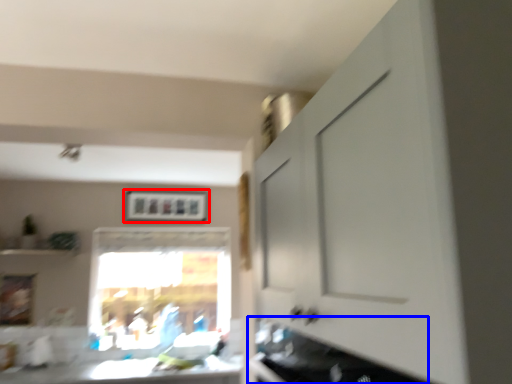
Question: Which point is further to the camera, picture frame (highlighted by a red box) or cabinetry (highlighted by a blue box)?

Choices:
 (A) picture frame
 (B) cabinetry

Answer: (A)